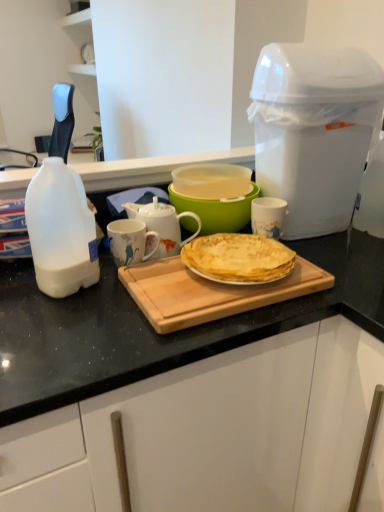
Question: Relative to wooden cutting board at center, is white ceramic mug at center, arranged as the 1th mug when viewed from the left, in front or behind?

Choices:
 (A) front
 (B) behind

Answer: (B)

Question: Does point (139, 256) appear closer or farther from the camera than point (233, 294)?

Choices:
 (A) farther
 (B) closer

Answer: (A)

Question: Which of these objects is positioned farthest from the white ceramic mug at center?

Choices:
 (A) white ceramic mug at center, positioned as the 2th mug in right-to-left order
 (B) wooden cutting board at center
 (C) yellow crepe at center
 (D) white plastic bottle at left
 (E) translucent plastic bowl at center

Answer: (D)

Question: Based on their relative distances, which object is nearer to the translucent plastic bowl at center?

Choices:
 (A) white plastic trash can at upper right
 (B) white glossy mug at center, which is the first mug from right to left
 (C) white ceramic mug at center
 (D) wooden cutting board at center
 (E) white plastic bottle at left

Answer: (C)